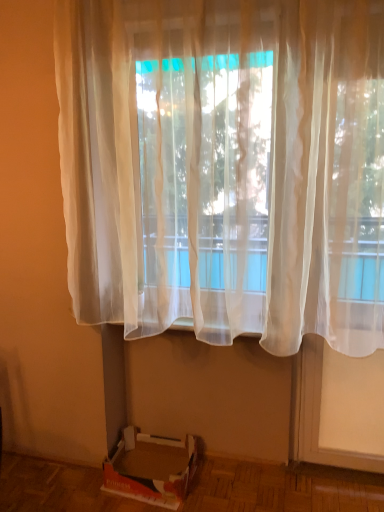
Question: Would you say translucent white curtain at center is a long distance from cardboard box at lower left?

Choices:
 (A) yes
 (B) no

Answer: (A)

Question: Can you confirm if translucent white curtain at center is shorter than cardboard box at lower left?

Choices:
 (A) no
 (B) yes

Answer: (A)

Question: From the image's perspective, does translucent white curtain at center appear lower than cardboard box at lower left?

Choices:
 (A) no
 (B) yes

Answer: (A)

Question: Is translucent white curtain at center outside of cardboard box at lower left?

Choices:
 (A) yes
 (B) no

Answer: (A)

Question: Is translucent white curtain at center surrounding cardboard box at lower left?

Choices:
 (A) yes
 (B) no

Answer: (B)

Question: Can you confirm if translucent white curtain at center is smaller than cardboard box at lower left?

Choices:
 (A) no
 (B) yes

Answer: (A)

Question: Is cardboard box at lower left taller than translucent white curtain at center?

Choices:
 (A) yes
 (B) no

Answer: (B)

Question: From a real-world perspective, is cardboard box at lower left on translucent white curtain at center?

Choices:
 (A) no
 (B) yes

Answer: (A)

Question: Does cardboard box at lower left have a greater width compared to translucent white curtain at center?

Choices:
 (A) yes
 (B) no

Answer: (A)

Question: Is cardboard box at lower left not inside translucent white curtain at center?

Choices:
 (A) no
 (B) yes

Answer: (B)

Question: Could you tell me if cardboard box at lower left is turned towards translucent white curtain at center?

Choices:
 (A) yes
 (B) no

Answer: (B)

Question: From a real-world perspective, is cardboard box at lower left beneath translucent white curtain at center?

Choices:
 (A) no
 (B) yes

Answer: (B)

Question: In terms of height, does cardboard box at lower left look taller or shorter compared to translucent white curtain at center?

Choices:
 (A) tall
 (B) short

Answer: (B)